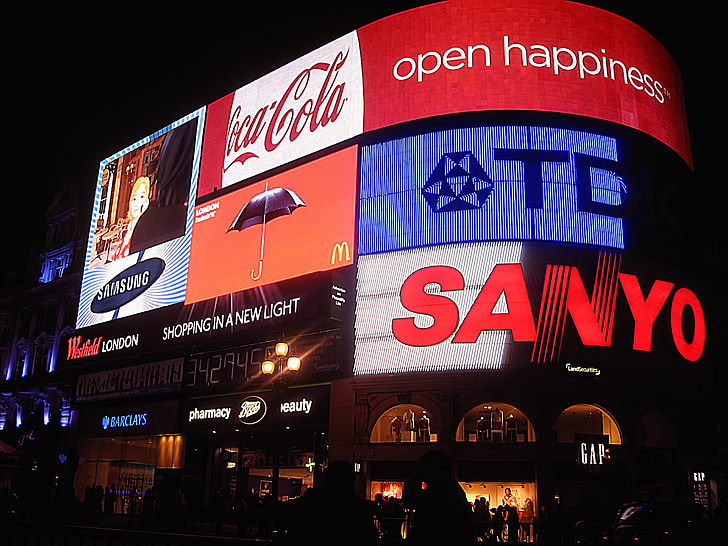
Find the location of a particular element. The height and width of the screenshot is (546, 728). painting is located at coordinates (505, 497).